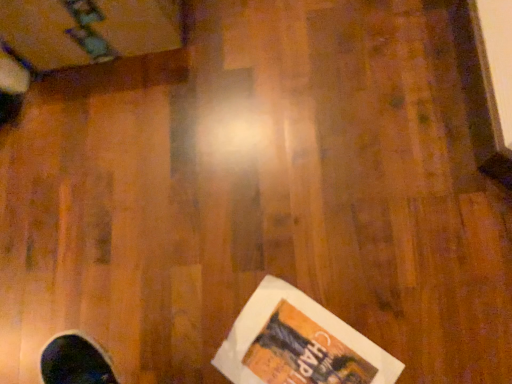
Measure the distance between point [293,292] and camera.

Point [293,292] and camera are 82.80 centimeters apart.

The height and width of the screenshot is (384, 512). What do you see at coordinates (298, 344) in the screenshot?
I see `white paper flyer at lower right` at bounding box center [298, 344].

The image size is (512, 384). In order to click on white paper flyer at lower right in this screenshot , I will do `click(298, 344)`.

Locate an element on the screen. The width and height of the screenshot is (512, 384). white paper flyer at lower right is located at coordinates (x=298, y=344).